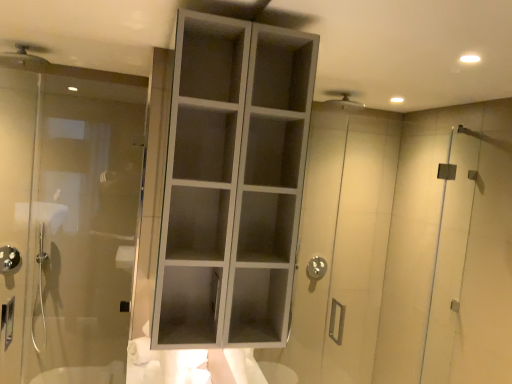
Question: Is transparent glass door at left facing towards white matte cabinet at center?

Choices:
 (A) no
 (B) yes

Answer: (A)

Question: Can we say transparent glass door at left lies outside white matte cabinet at center?

Choices:
 (A) yes
 (B) no

Answer: (A)

Question: From the image's perspective, would you say transparent glass door at left is positioned over white matte cabinet at center?

Choices:
 (A) yes
 (B) no

Answer: (B)

Question: Does transparent glass door at left have a larger size compared to white matte cabinet at center?

Choices:
 (A) yes
 (B) no

Answer: (B)

Question: Is transparent glass door at left shorter than white matte cabinet at center?

Choices:
 (A) yes
 (B) no

Answer: (B)

Question: Considering the relative positions of transparent glass door at left and white matte cabinet at center in the image provided, is transparent glass door at left in front of white matte cabinet at center?

Choices:
 (A) yes
 (B) no

Answer: (B)

Question: Considering the relative sizes of matte silver shower head at upper left, the 1th shower from the front, and brushed metal showerhead at lower left, the first shower when ordered from back to front, in the image provided, is matte silver shower head at upper left, the 1th shower from the front, wider than brushed metal showerhead at lower left, the first shower when ordered from back to front,?

Choices:
 (A) yes
 (B) no

Answer: (A)

Question: Is matte silver shower head at upper left, which appears as the 1th shower when viewed from the right, oriented away from brushed metal showerhead at lower left, which appears as the 2th shower when viewed from the top?

Choices:
 (A) yes
 (B) no

Answer: (B)

Question: Would you say matte silver shower head at upper left, which is counted as the 2th shower, starting from the back, is a long distance from brushed metal showerhead at lower left, which is the first shower in left-to-right order?

Choices:
 (A) no
 (B) yes

Answer: (B)

Question: Does matte silver shower head at upper left, which is counted as the 2th shower, starting from the back, have a lesser width compared to brushed metal showerhead at lower left, positioned as the 2th shower in right-to-left order?

Choices:
 (A) no
 (B) yes

Answer: (A)

Question: From a real-world perspective, does matte silver shower head at upper left, which is counted as the 2th shower, starting from the back, sit lower than brushed metal showerhead at lower left, the first shower when ordered from back to front?

Choices:
 (A) yes
 (B) no

Answer: (B)

Question: From the image's perspective, is matte silver shower head at upper left, which is counted as the 2th shower, starting from the back, on top of brushed metal showerhead at lower left, the first shower when ordered from back to front?

Choices:
 (A) no
 (B) yes

Answer: (B)

Question: Are brushed metal showerhead at lower left, the first shower when ordered from back to front, and white matte cabinet at center making contact?

Choices:
 (A) no
 (B) yes

Answer: (A)